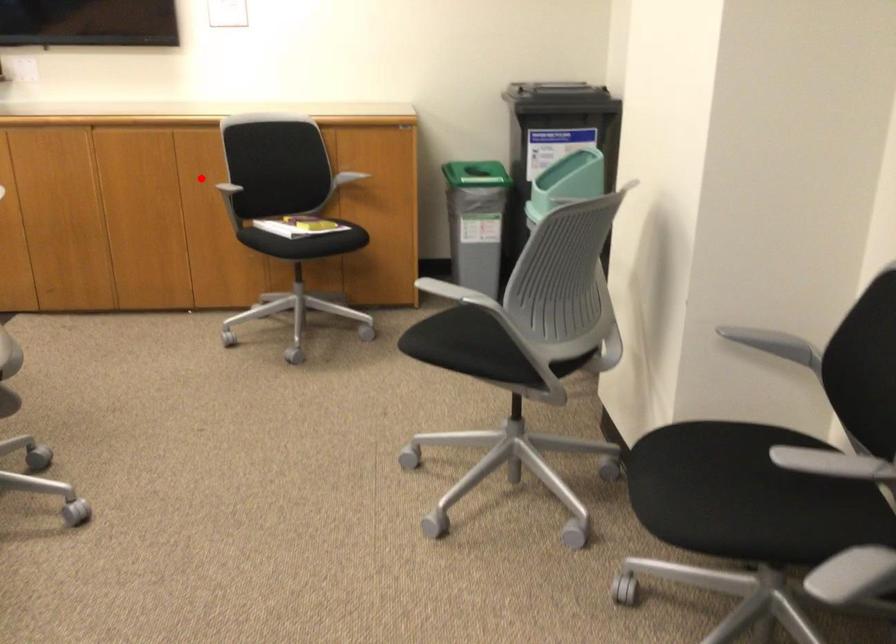
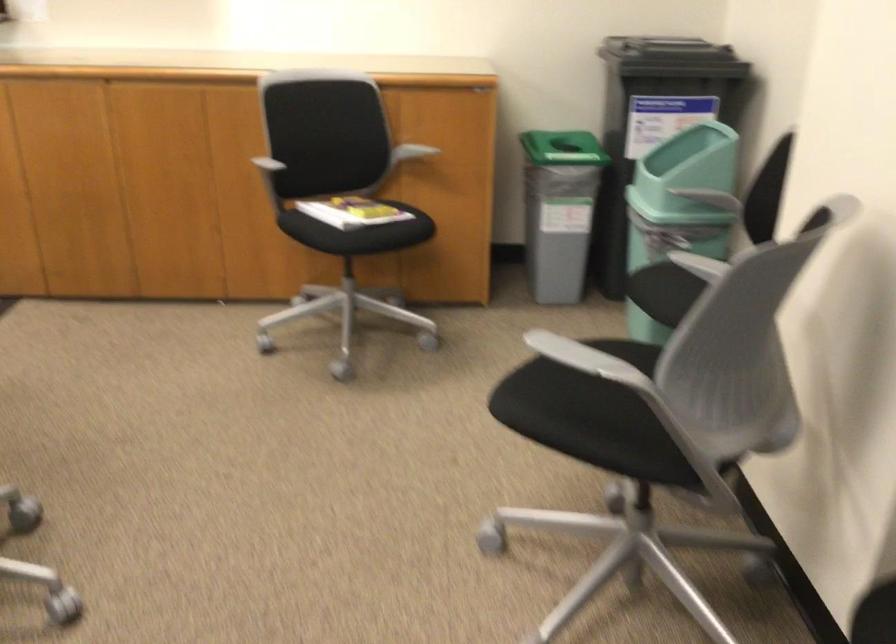
Question: I am providing you with two images of the same scene from different viewpoints. In image1, a red point is highlighted. Considering the same 3D point in image2, which of the following is correct?

Choices:
 (A) It is closer
 (B) It is farther

Answer: (A)